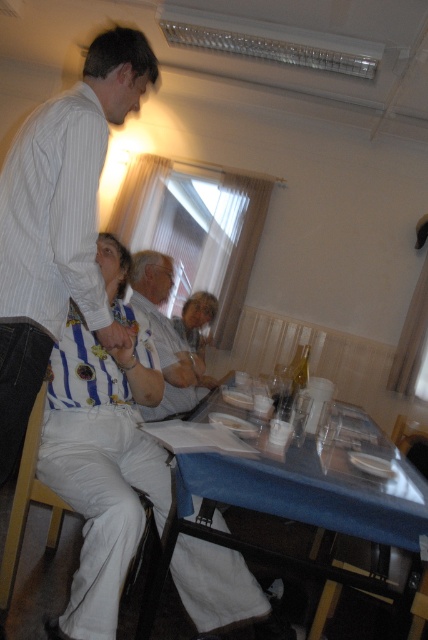
You are sitting in a white fabric chair at lower left and want to reach the blue fabric table at lower center. Which direction should you move to get there?

The blue fabric table at lower center is to the right of the white fabric chair at lower left, so you should move to your right to reach it.

You are a guest at this gathering and want to know what clothing item is at the center of the scene. Based on the coordinates provided, what is the clothing item located at point [104,449]?

The striped fabric shirt at center is represented by point [104,449].

You are a server carrying a tray of drinks and need to navigate between the blue fabric table at lower center and the white fabric chair at lower left. The tray is 30 inches wide. Can you safely pass through the space between them without spilling the drinks?

The blue fabric table at lower center and white fabric chair at lower left are 32.60 inches apart. Since the tray is 30 inches wide, there is enough space to pass safely between them without spilling the drinks.